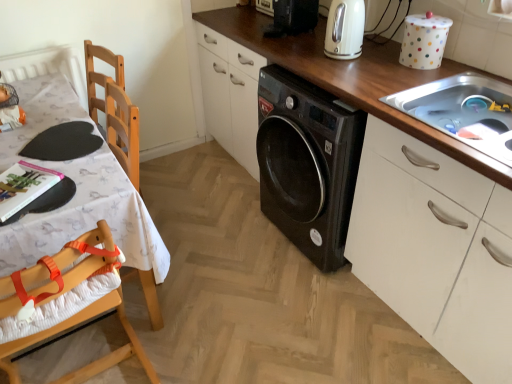
Question: Is black plastic washing machine at upper center, which is counted as the first appliance, starting from the left, wider or thinner than white polka dot container at upper right, which ranks as the first appliance in right-to-left order?

Choices:
 (A) wide
 (B) thin

Answer: (A)

Question: Is black plastic washing machine at upper center, which is counted as the first appliance, starting from the left, bigger or smaller than white polka dot container at upper right, arranged as the second appliance when viewed from the left?

Choices:
 (A) small
 (B) big

Answer: (B)

Question: Which object is the closest to the stainless steel sink at upper right?

Choices:
 (A) black plastic washing machine at upper center, which is counted as the first appliance, starting from the left
 (B) wooden table at left
 (C) white polka dot container at upper right, which ranks as the first appliance in right-to-left order
 (D) white glossy electric kettle at upper center
 (E) wooden at center

Answer: (C)

Question: Which of these objects is positioned farthest from the wooden table at left?

Choices:
 (A) stainless steel sink at upper right
 (B) wooden at center
 (C) wooden highchair at left
 (D) white glossy electric kettle at upper center
 (E) black plastic washing machine at upper center, the second appliance when ordered from bottom to top

Answer: (A)